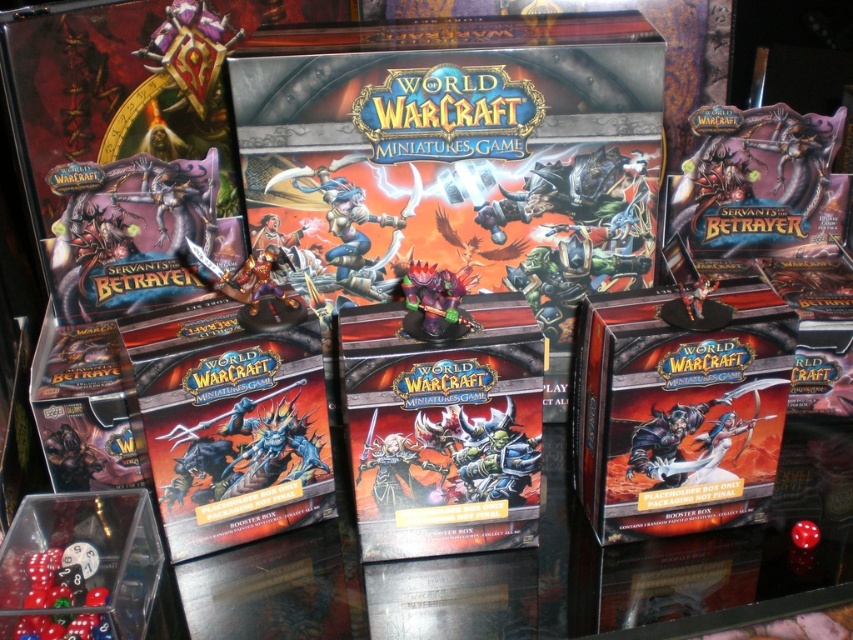
Question: Is translucent plastic dice at lower left bigger than satin purple figurine at center?

Choices:
 (A) yes
 (B) no

Answer: (B)

Question: From the image, what is the correct spatial relationship of translucent plastic dice at lower left in relation to satin purple figurine at center?

Choices:
 (A) left
 (B) right

Answer: (A)

Question: Which point appears closest to the camera in this image?

Choices:
 (A) (61, 568)
 (B) (461, 326)

Answer: (B)

Question: Is the position of translucent plastic dice at lower left more distant than that of satin purple figurine at center?

Choices:
 (A) yes
 (B) no

Answer: (B)

Question: Among these objects, which one is farthest from the camera?

Choices:
 (A) satin purple figurine at center
 (B) translucent plastic dice at lower left

Answer: (A)